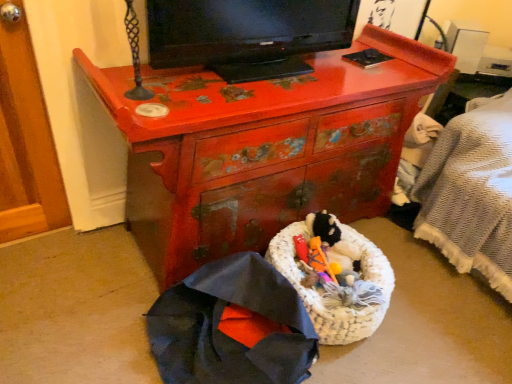
I want to click on vacant point to the right of white woven laundry basket at center, so click(x=441, y=308).